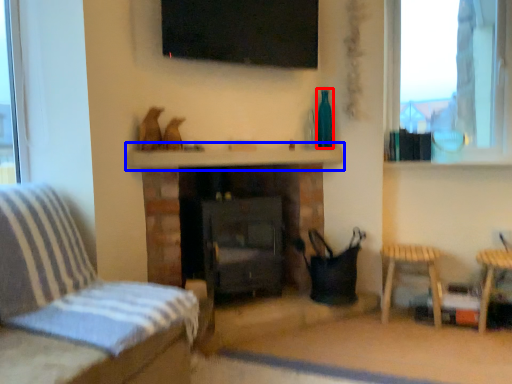
Question: Which object appears farthest to the camera in this image, bottle (highlighted by a red box) or mantle (highlighted by a blue box)?

Choices:
 (A) bottle
 (B) mantle

Answer: (A)